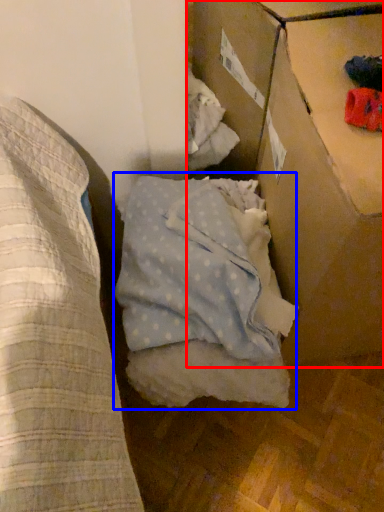
Question: Among these objects, which one is farthest to the camera, cardboard box (highlighted by a red box) or sheet (highlighted by a blue box)?

Choices:
 (A) cardboard box
 (B) sheet

Answer: (B)